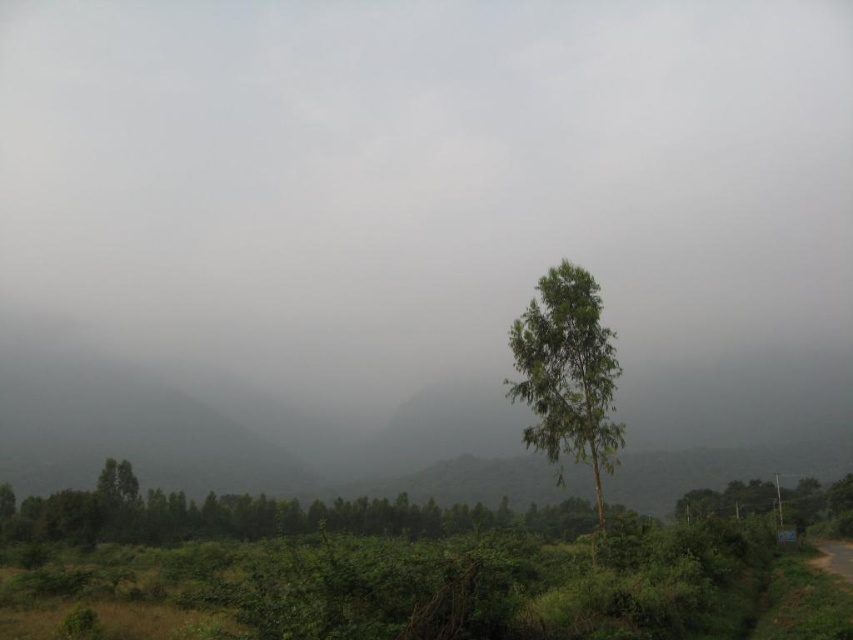
You are an environmental scientist assessing the health of a forest. You observe two green leafy trees in the scene. Which tree, the green leafy tree at center or the green leafy tree at lower right, might indicate better growth potential based on their sizes?

The green leafy tree at lower right is larger than the green leafy tree at center, suggesting it has better growth potential due to its size.

You are an outdoor photographer aiming to capture the green leafy tree at center and the green leafy tree at lower right in a single shot. Which tree will appear closer to the camera in your photo?

The green leafy tree at center is in front of the green leafy tree at lower right, so it will appear closer to the camera in the photo.

You are standing in the misty landscape and want to reach the green leafy tree at center. Which direction should you move relative to your current position?

The green leafy tree at center is located at point (567, 374), so you should move towards the center of the scene to reach it.